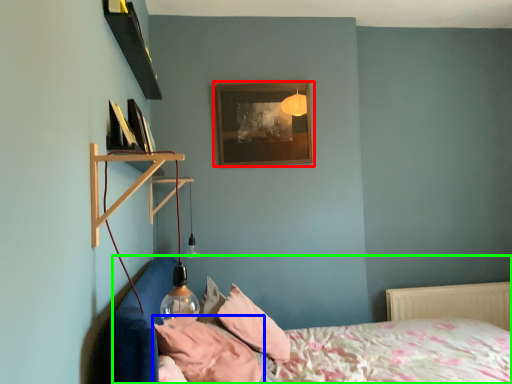
Question: Which object is the farthest from picture frame (highlighted by a red box)? Choose among these: pillow (highlighted by a blue box) or bed (highlighted by a green box).

Choices:
 (A) pillow
 (B) bed

Answer: (A)